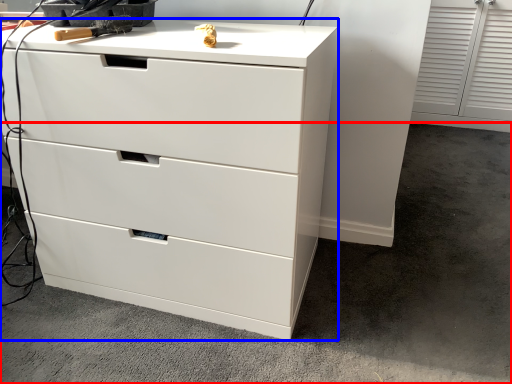
Question: Which of the following is the farthest to the observer, concrete (highlighted by a red box) or chest of drawers (highlighted by a blue box)?

Choices:
 (A) concrete
 (B) chest of drawers

Answer: (B)